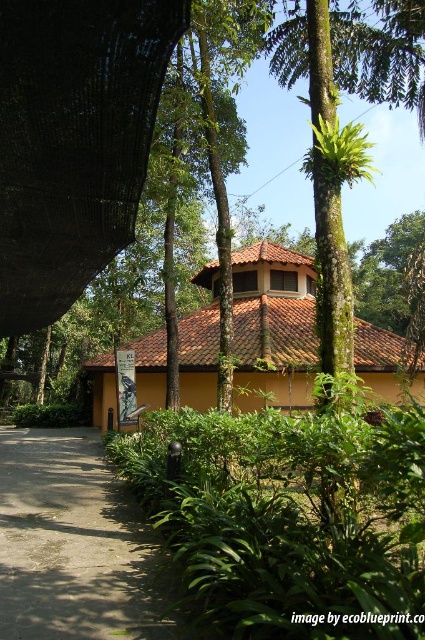
Question: Which point appears closest to the camera in this image?

Choices:
 (A) click(153, 120)
 (B) click(408, 451)
 (C) click(28, 504)

Answer: (B)

Question: Which is nearer to the green leafy shrubs at center?

Choices:
 (A) gray concrete driveway at lower left
 (B) black mesh canopy at upper left

Answer: (A)

Question: Does green leafy shrubs at center appear under black mesh canopy at upper left?

Choices:
 (A) no
 (B) yes

Answer: (B)

Question: Estimate the real-world distances between objects in this image. Which object is closer to the gray concrete driveway at lower left?

Choices:
 (A) green leafy shrubs at center
 (B) black mesh canopy at upper left

Answer: (A)

Question: Can you confirm if black mesh canopy at upper left is bigger than gray concrete driveway at lower left?

Choices:
 (A) yes
 (B) no

Answer: (B)

Question: Can you confirm if green leafy shrubs at center is positioned above black mesh canopy at upper left?

Choices:
 (A) yes
 (B) no

Answer: (B)